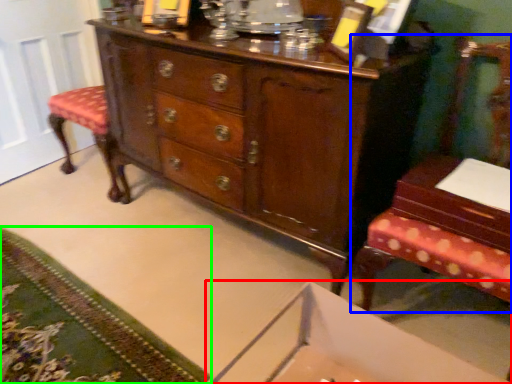
Question: Which object is positioned closest to changing table (highlighted by a red box)? Select from furniture (highlighted by a blue box) and mat (highlighted by a green box).

Choices:
 (A) furniture
 (B) mat

Answer: (A)